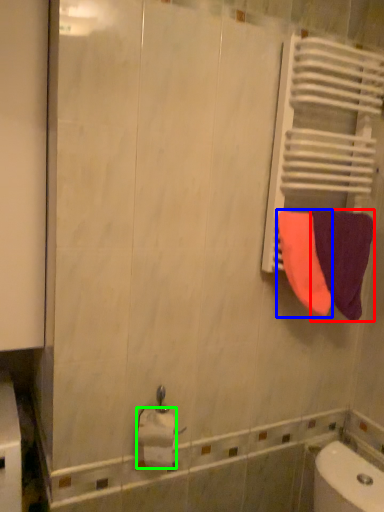
Question: Which is nearer to the towel (highlighted by a red box)? towel (highlighted by a blue box) or toilet paper (highlighted by a green box).

Choices:
 (A) towel
 (B) toilet paper

Answer: (A)